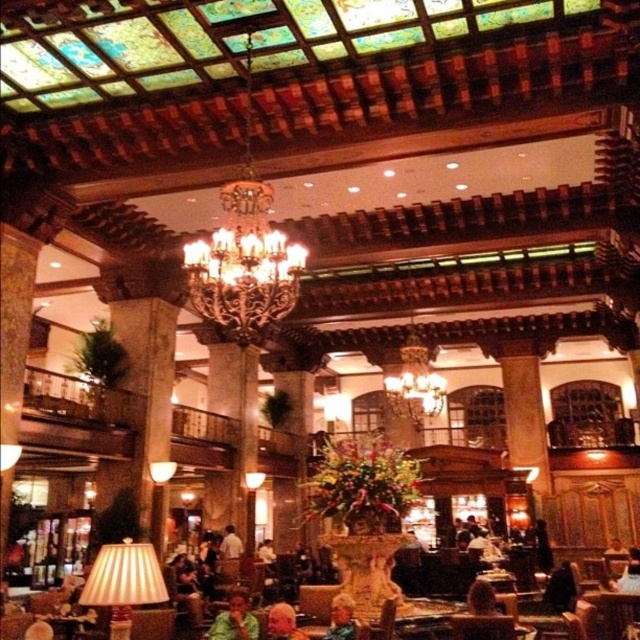
Can you confirm if wooden chair at center is bigger than light brown leather jacket at center?

Correct, wooden chair at center is larger in size than light brown leather jacket at center.

Locate an element on the screen. The width and height of the screenshot is (640, 640). wooden chair at center is located at coordinates (381, 621).

Find the location of a particular element. wooden chair at center is located at coordinates (381, 621).

Is brown leather chair at lower center bigger than wooden chair at center?

Actually, brown leather chair at lower center might be smaller than wooden chair at center.

Measure the distance between point (493, 625) and camera.

19.88 feet

Image resolution: width=640 pixels, height=640 pixels. In order to click on brown leather chair at lower center in this screenshot , I will do `click(481, 627)`.

Between dark brown leather chair at center and wooden chair at center, which one appears on the right side from the viewer's perspective?

dark brown leather chair at center is more to the right.

Consider the image. Does dark brown leather chair at center appear over wooden chair at center?

Yes, dark brown leather chair at center is above wooden chair at center.

At what (x,y) coordinates should I click in order to perform the action: click on dark brown leather chair at center. Please return your answer as a coordinate pair (x, y). Image resolution: width=640 pixels, height=640 pixels. Looking at the image, I should click on (483, 598).

The image size is (640, 640). I want to click on dark brown leather chair at center, so [x=483, y=598].